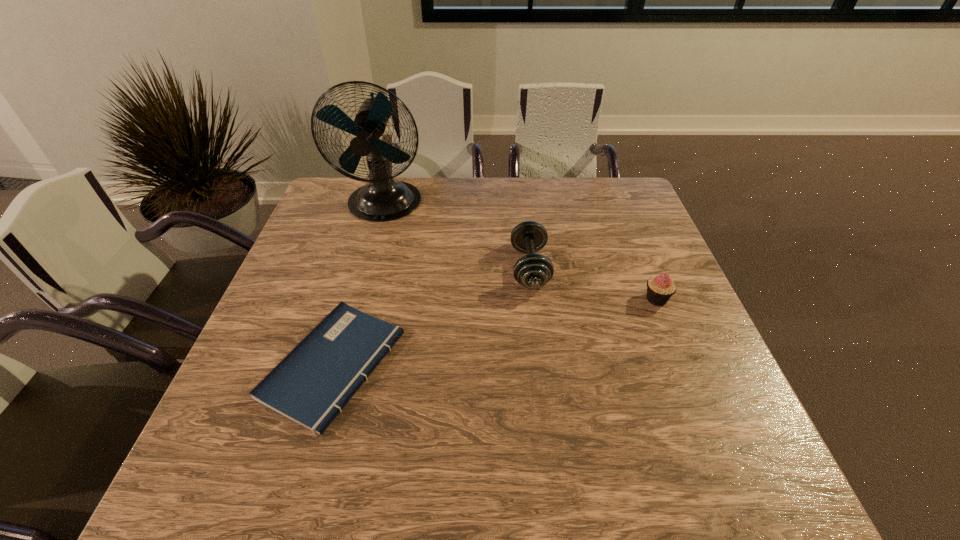
You are a GUI agent. You are given a task and a screenshot of the screen. Output one action in this format:
    pyautogui.click(x=<x>, y=<y>)
    Task: Click on the object situated at the far edge
    Image resolution: width=960 pixels, height=540 pixels.
    Given the screenshot: What is the action you would take?
    pyautogui.click(x=383, y=199)

Image resolution: width=960 pixels, height=540 pixels. In order to click on fan that is at the left edge in this screenshot , I will do `click(383, 199)`.

In order to click on paperback book positioned at the left edge in this screenshot , I will do `click(312, 384)`.

The image size is (960, 540). I want to click on object positioned at the right edge, so click(x=660, y=288).

This screenshot has width=960, height=540. I want to click on object located in the far left corner section of the desktop, so click(383, 199).

This screenshot has width=960, height=540. I want to click on vacant space at the far edge of the desktop, so click(x=517, y=193).

Locate an element on the screen. blank space at the near edge is located at coordinates (351, 489).

Image resolution: width=960 pixels, height=540 pixels. In the image, there is a desktop. In order to click on vacant region at the left edge in this screenshot , I will do `click(351, 230)`.

In the image, there is a desktop. What are the coordinates of `free space at the right edge` in the screenshot? It's located at (623, 227).

The height and width of the screenshot is (540, 960). In the image, there is a desktop. Find the location of `vacant space at the far right corner`. vacant space at the far right corner is located at coordinates tap(585, 187).